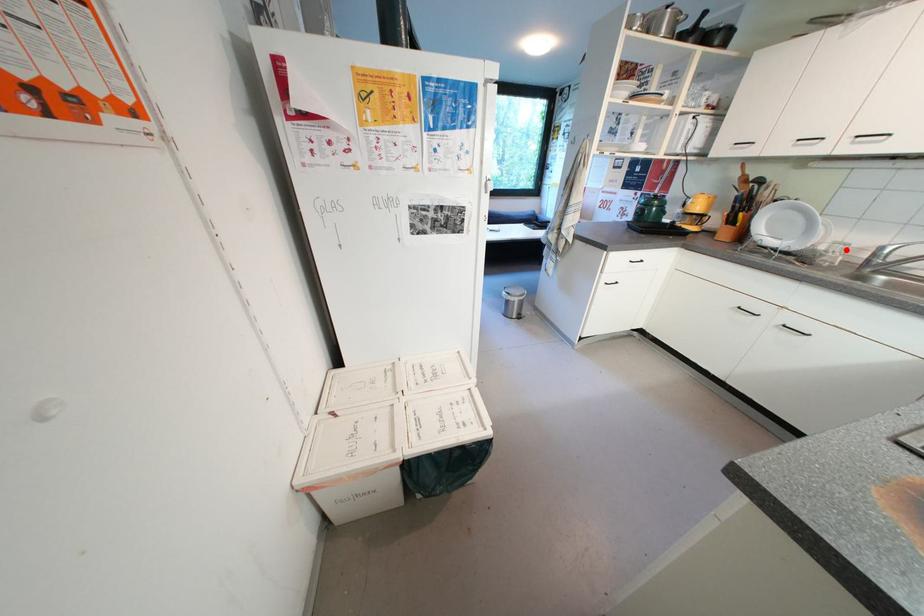
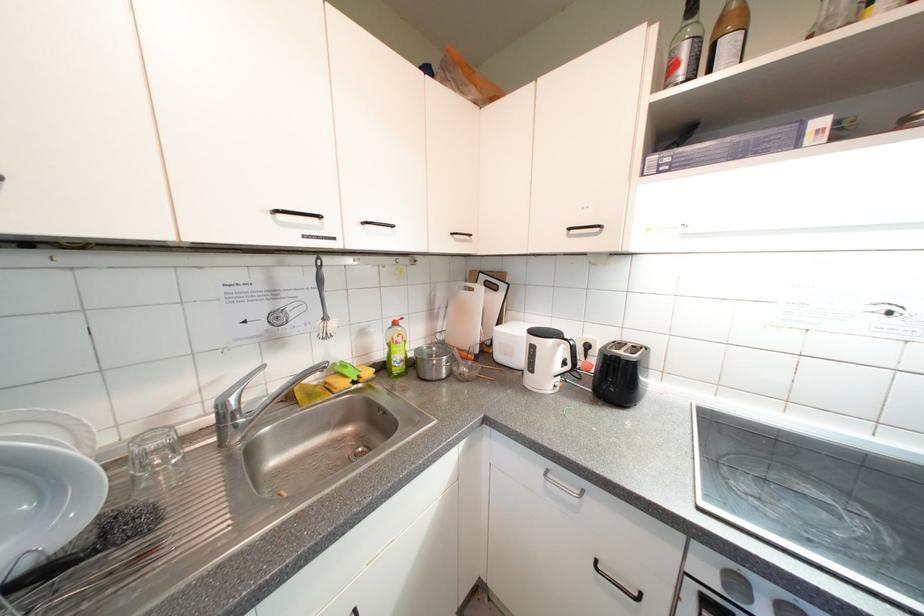
Question: I am providing you with two images of the same scene from different viewpoints. Image1 has a red point marked. In image2, the corresponding 3D location appears at what relative position? Reply with the corresponding letter.

Choices:
 (A) Closer
 (B) Farther

Answer: (A)